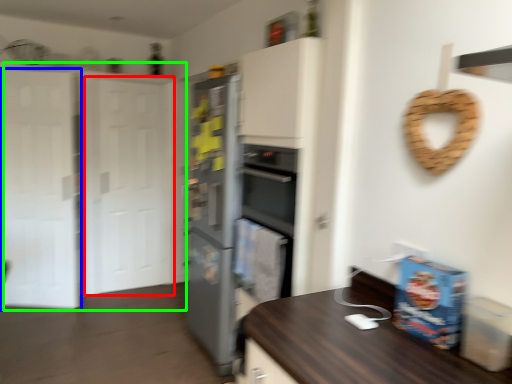
Question: Estimate the real-world distances between objects in this image. Which object is farther from glass door (highlighted by a red box), glass door (highlighted by a blue box) or door (highlighted by a green box)?

Choices:
 (A) glass door
 (B) door

Answer: (A)